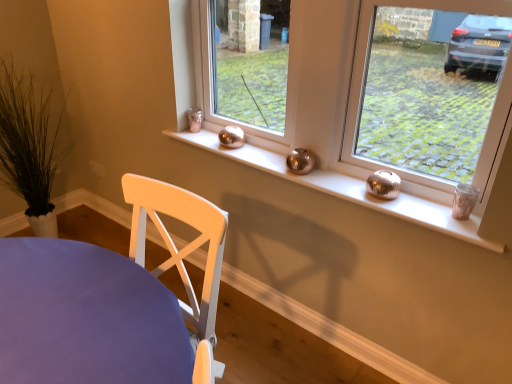
Describe the element at coordinates (383, 185) in the screenshot. The height and width of the screenshot is (384, 512). I see `shiny metallic candle holder at right` at that location.

Find the location of a particular element. metallic silver vases at center, which is counted as the 2th window, starting from the left is located at coordinates (333, 132).

What are the coordinates of `metallic silver candle at center, which ranks as the first window in left-to-right order` in the screenshot? It's located at (242, 64).

How much space does metallic silver candle at center, the 3th window when ordered from right to left, occupy vertically?

metallic silver candle at center, the 3th window when ordered from right to left, is 25.58 inches tall.

Where is `shiny metallic candle holder at right`? Image resolution: width=512 pixels, height=384 pixels. shiny metallic candle holder at right is located at coordinates (383, 185).

Is shiny metallic candle holder at right surrounded by white painted wood chair at lower left?

Definitely not — shiny metallic candle holder at right is not inside white painted wood chair at lower left.

Could you tell me if white painted wood chair at lower left is facing shiny metallic candle holder at right?

No, white painted wood chair at lower left does not turn towards shiny metallic candle holder at right.

From the image's perspective, is white painted wood chair at lower left on shiny metallic candle holder at right?

Actually, white painted wood chair at lower left appears below shiny metallic candle holder at right in the image.

Considering the relative positions of white painted wood chair at lower left and shiny metallic candle holder at right in the image provided, is white painted wood chair at lower left behind shiny metallic candle holder at right?

No, it is not.

Looking at this image, in the image, is white painted wood chair at lower left positioned in front of or behind metallic silver candle at center, which ranks as the first window in left-to-right order?

Visually, white painted wood chair at lower left is located in front of metallic silver candle at center, which ranks as the first window in left-to-right order.

Would you say white painted wood chair at lower left is outside metallic silver candle at center, which ranks as the first window in left-to-right order?

Absolutely, white painted wood chair at lower left is external to metallic silver candle at center, which ranks as the first window in left-to-right order.

In the scene shown: From the image's perspective, is white painted wood chair at lower left on top of metallic silver candle at center, which ranks as the first window in left-to-right order?

No, from the image's perspective, white painted wood chair at lower left is not on top of metallic silver candle at center, which ranks as the first window in left-to-right order.

From a real-world perspective, is white painted wood chair at lower left over metallic silver candle at center, which ranks as the first window in left-to-right order?

No, from a real-world perspective, white painted wood chair at lower left is not above metallic silver candle at center, which ranks as the first window in left-to-right order.

Looking at this image, from the image's perspective, between metallic silver candle holder at right, arranged as the first window when viewed from the right, and metallic silver vases at center, which is counted as the 2th window, starting from the left, which one is located above?

metallic silver candle holder at right, arranged as the first window when viewed from the right.

Can you confirm if metallic silver candle holder at right, the 3th window from the left, is positioned to the right of metallic silver vases at center, the second window when ordered from right to left?

Correct, you'll find metallic silver candle holder at right, the 3th window from the left, to the right of metallic silver vases at center, the second window when ordered from right to left.

The width and height of the screenshot is (512, 384). Identify the location of window on the right of metallic silver vases at center, the second window when ordered from right to left. (430, 95).

Between point (424, 76) and point (428, 218), which one is positioned in front?

The point (428, 218) is closer to the camera.

Looking at this image, considering the relative sizes of metallic silver candle at center, the 3th window when ordered from right to left, and white painted wood chair at lower left in the image provided, is metallic silver candle at center, the 3th window when ordered from right to left, shorter than white painted wood chair at lower left?

Correct, metallic silver candle at center, the 3th window when ordered from right to left, is not as tall as white painted wood chair at lower left.

Find the location of a particular element. This screenshot has width=512, height=384. window that is the 1st one when counting rightward from the white painted wood chair at lower left is located at coordinates tap(242, 64).

Could you tell me if metallic silver candle at center, the 3th window when ordered from right to left, is facing white painted wood chair at lower left?

Yes, metallic silver candle at center, the 3th window when ordered from right to left, is turned towards white painted wood chair at lower left.

Is metallic silver candle holder at right, arranged as the first window when viewed from the right, closer to the viewer compared to metallic silver candle at center, which ranks as the first window in left-to-right order?

Yes, it is.

From the image's perspective, relative to metallic silver candle at center, which ranks as the first window in left-to-right order, is metallic silver candle holder at right, the 3th window from the left, above or below?

From the image's perspective, metallic silver candle holder at right, the 3th window from the left, appears below metallic silver candle at center, which ranks as the first window in left-to-right order.

Does metallic silver candle holder at right, the 3th window from the left, turn towards metallic silver candle at center, the 3th window when ordered from right to left?

No, metallic silver candle holder at right, the 3th window from the left, does not turn towards metallic silver candle at center, the 3th window when ordered from right to left.

From a real-world perspective, is metallic silver vases at center, which is counted as the 2th window, starting from the left, above or below white painted wood chair at lower left?

metallic silver vases at center, which is counted as the 2th window, starting from the left, is above white painted wood chair at lower left.

Considering the sizes of objects metallic silver vases at center, the second window when ordered from right to left, and white painted wood chair at lower left in the image provided, who is taller, metallic silver vases at center, the second window when ordered from right to left, or white painted wood chair at lower left?

Standing taller between the two is white painted wood chair at lower left.

What's the angular difference between metallic silver vases at center, which is counted as the 2th window, starting from the left, and white painted wood chair at lower left's facing directions?

There is a 6.7-degree angle between the facing directions of metallic silver vases at center, which is counted as the 2th window, starting from the left, and white painted wood chair at lower left.

I want to click on chair located on the left of metallic silver vases at center, which is counted as the 2th window, starting from the left, so click(x=112, y=301).

From the picture: Which object is positioned more to the left, metallic silver candle at center, which ranks as the first window in left-to-right order, or metallic silver candle holder at right, the 3th window from the left?

metallic silver candle at center, which ranks as the first window in left-to-right order, is more to the left.

Is metallic silver candle at center, which ranks as the first window in left-to-right order, not close to metallic silver candle holder at right, the 3th window from the left?

They are positioned close to each other.

From the image's perspective, which one is positioned lower, metallic silver candle at center, which ranks as the first window in left-to-right order, or metallic silver candle holder at right, arranged as the first window when viewed from the right?

metallic silver candle holder at right, arranged as the first window when viewed from the right, from the image's perspective.

Which of these two, metallic silver candle at center, the 3th window when ordered from right to left, or metallic silver candle holder at right, the 3th window from the left, is smaller?

metallic silver candle at center, the 3th window when ordered from right to left.

Locate an element on the screen. chair in front of the shiny metallic candle holder at right is located at coordinates (112, 301).

The width and height of the screenshot is (512, 384). What are the coordinates of `the 3rd window behind the white painted wood chair at lower left` in the screenshot? It's located at (242, 64).

Which object lies nearer to the anchor point metallic silver vases at center, which is counted as the 2th window, starting from the left, metallic silver candle holder at right, arranged as the first window when viewed from the right, or shiny metallic candle holder at right?

The object closer to metallic silver vases at center, which is counted as the 2th window, starting from the left, is shiny metallic candle holder at right.

In the scene shown: From the image, which object appears to be nearer to metallic silver vases at center, which is counted as the 2th window, starting from the left, metallic silver candle holder at right, arranged as the first window when viewed from the right, or metallic silver candle at center, which ranks as the first window in left-to-right order?

The object closer to metallic silver vases at center, which is counted as the 2th window, starting from the left, is metallic silver candle at center, which ranks as the first window in left-to-right order.

Based on their spatial positions, is metallic silver candle holder at right, the 3th window from the left, or shiny metallic candle holder at right further from white painted wood chair at lower left?

Among the two, metallic silver candle holder at right, the 3th window from the left, is located further to white painted wood chair at lower left.

Estimate the real-world distances between objects in this image. Which object is closer to metallic silver candle holder at right, arranged as the first window when viewed from the right, metallic silver candle at center, which ranks as the first window in left-to-right order, or shiny metallic candle holder at right?

Among the two, metallic silver candle at center, which ranks as the first window in left-to-right order, is located nearer to metallic silver candle holder at right, arranged as the first window when viewed from the right.

From the image, which object appears to be farther from metallic silver candle at center, which ranks as the first window in left-to-right order, shiny metallic candle holder at right or white painted wood chair at lower left?

white painted wood chair at lower left lies further to metallic silver candle at center, which ranks as the first window in left-to-right order, than the other object.

Estimate the real-world distances between objects in this image. Which object is closer to metallic silver vases at center, the second window when ordered from right to left, metallic silver candle holder at right, arranged as the first window when viewed from the right, or white painted wood chair at lower left?

The object closer to metallic silver vases at center, the second window when ordered from right to left, is metallic silver candle holder at right, arranged as the first window when viewed from the right.

Which object lies nearer to the anchor point white painted wood chair at lower left, shiny metallic candle holder at right or metallic silver vases at center, which is counted as the 2th window, starting from the left?

metallic silver vases at center, which is counted as the 2th window, starting from the left, lies closer to white painted wood chair at lower left than the other object.

Which object lies further to the anchor point metallic silver candle at center, which ranks as the first window in left-to-right order, metallic silver vases at center, the second window when ordered from right to left, or white painted wood chair at lower left?

The object further to metallic silver candle at center, which ranks as the first window in left-to-right order, is white painted wood chair at lower left.

The width and height of the screenshot is (512, 384). I want to click on candle holder between white painted wood chair at lower left and metallic silver candle holder at right, the 3th window from the left, in the horizontal direction, so click(383, 185).

Identify the location of candle holder between metallic silver vases at center, which is counted as the 2th window, starting from the left, and metallic silver candle holder at right, the 3th window from the left, from left to right. This screenshot has width=512, height=384. (383, 185).

What are the coordinates of `candle holder between metallic silver candle at center, the 3th window when ordered from right to left, and white painted wood chair at lower left, in the vertical direction` in the screenshot? It's located at (383, 185).

Find the location of a particular element. This screenshot has height=384, width=512. candle holder located between metallic silver candle at center, which ranks as the first window in left-to-right order, and metallic silver candle holder at right, arranged as the first window when viewed from the right, in the left-right direction is located at coordinates (383, 185).